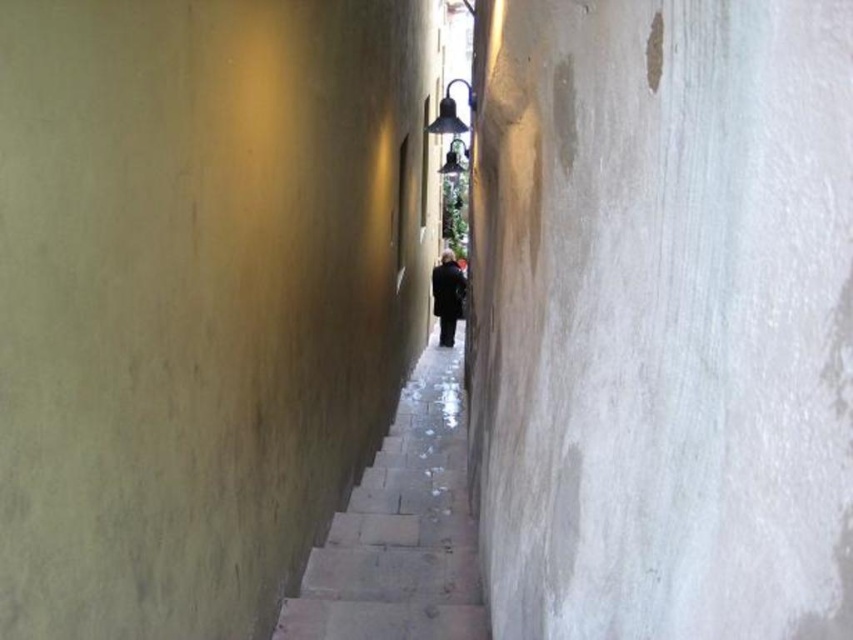
Who is more distant from viewer, (331, 621) or (454, 317)?

The point (454, 317) is behind.

What do you see at coordinates (401, 531) in the screenshot? I see `smooth stone steps at center` at bounding box center [401, 531].

Locate an element on the screen. The image size is (853, 640). smooth stone steps at center is located at coordinates coord(401,531).